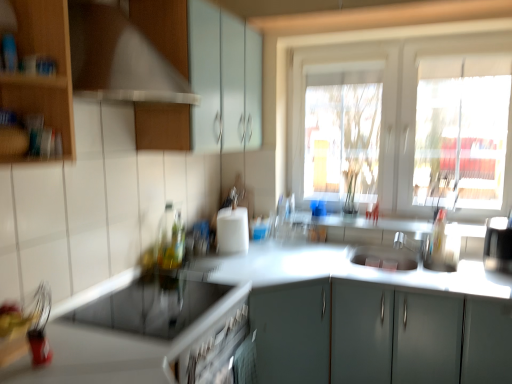
Image resolution: width=512 pixels, height=384 pixels. I want to click on spots to the right of translucent glass bottle at center, the 1th bottle viewed from the front, so click(214, 264).